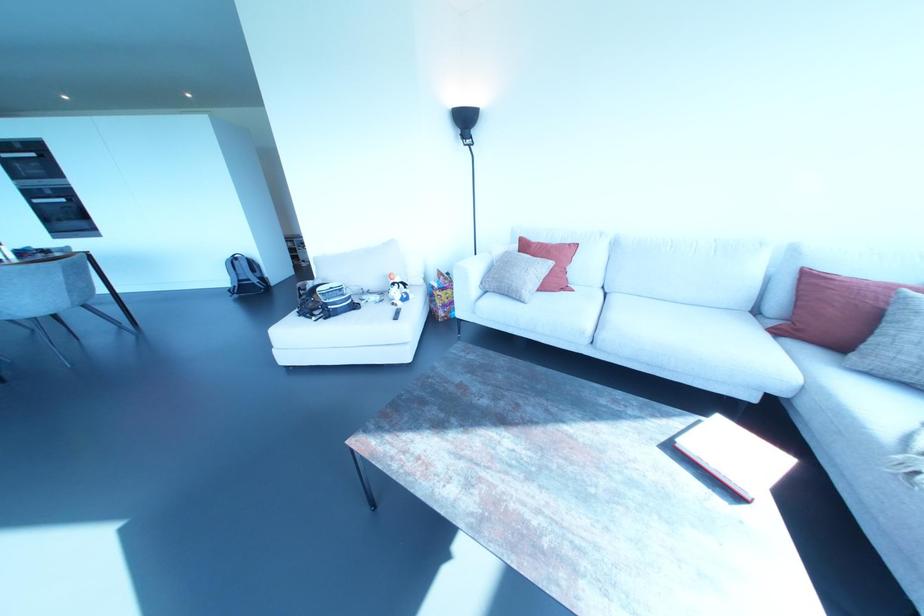
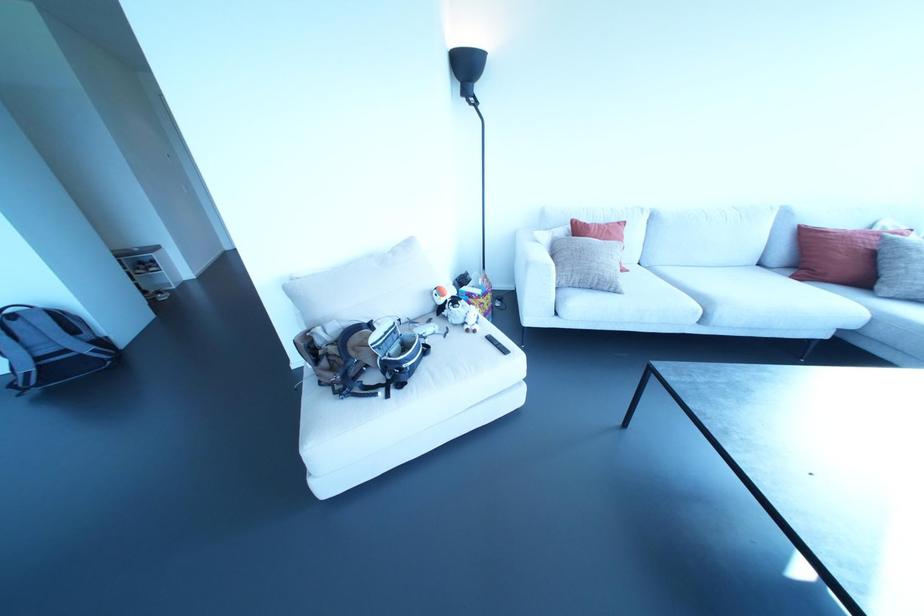
The point at (x=392, y=302) is marked in the first image. Where is the corresponding point in the second image?

(467, 330)